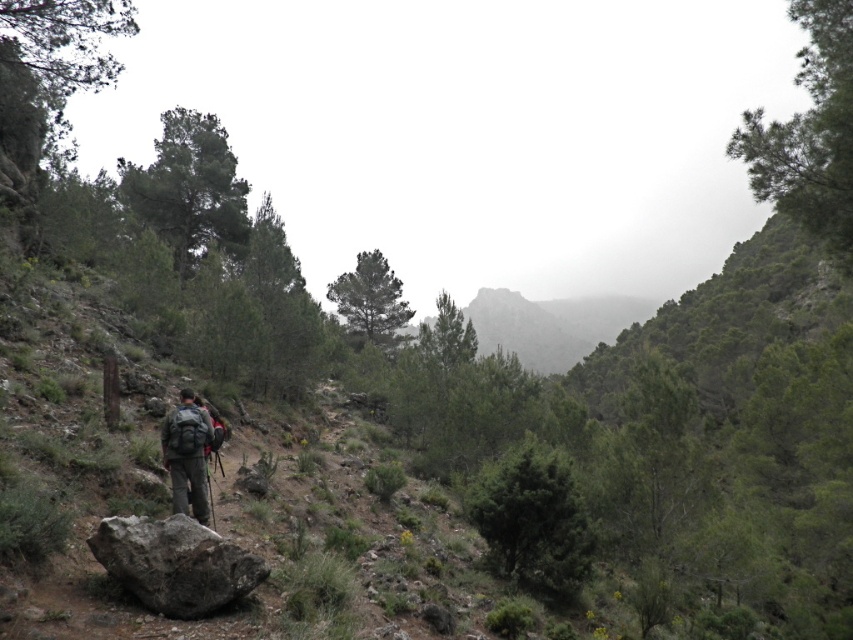
Is gray rough rock at lower left positioned at the back of matte gray backpack at center?

No, it is not.

Can you confirm if gray rough rock at lower left is shorter than matte gray backpack at center?

Yes.

Who is more forward, (x=213, y=609) or (x=184, y=452)?

Point (x=213, y=609)

Find the location of a particular element. The image size is (853, 640). gray rough rock at lower left is located at coordinates (x=175, y=563).

Is gray rough rock at lower left behind rocky gray mountain at center?

No, it is not.

Between point (248, 589) and point (480, 328), which one is positioned in front?

Point (248, 589) is in front.

At what (x,y) coordinates should I click in order to perform the action: click on gray rough rock at lower left. Please return your answer as a coordinate pair (x, y). Looking at the image, I should click on (175, 563).

Can you confirm if rocky gray mountain at center is positioned to the left of matte gray backpack at center?

In fact, rocky gray mountain at center is to the right of matte gray backpack at center.

What do you see at coordinates (550, 324) in the screenshot?
I see `rocky gray mountain at center` at bounding box center [550, 324].

The width and height of the screenshot is (853, 640). What do you see at coordinates (550, 324) in the screenshot? I see `rocky gray mountain at center` at bounding box center [550, 324].

Where is `rocky gray mountain at center`? rocky gray mountain at center is located at coordinates (550, 324).